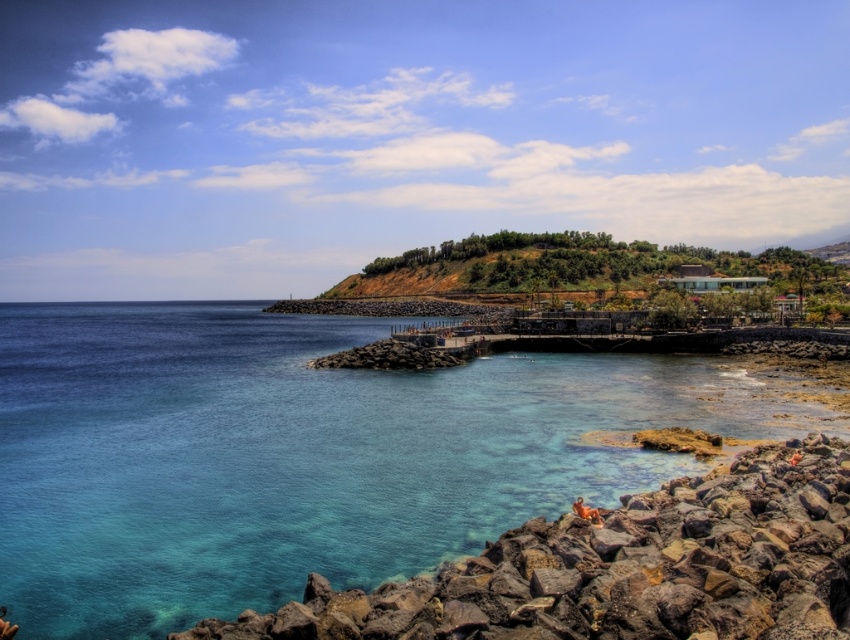
You are a hiker standing at the base of the green grassy hill at upper center and want to reach the clear blue water at center. Which direction should you go to descend towards the water?

You should go downhill from the green grassy hill at upper center to descend towards the clear blue water at center since the water is lower than the hill.

You are standing at the edge of the rockyrough stonerocks at lower right and want to walk towards the green grassy hill at upper center. Which direction should you head?

You should head to the right because the rockyrough stonerocks at lower right are to the left of the green grassy hill at upper center, so moving right will take you towards the hill.

Based on the scene, if you are standing on the green grassy hill at upper center, which direction would you face to look down at the clear blue water at center?

You would face downward because the clear blue water at center is located below the green grassy hill at upper center.